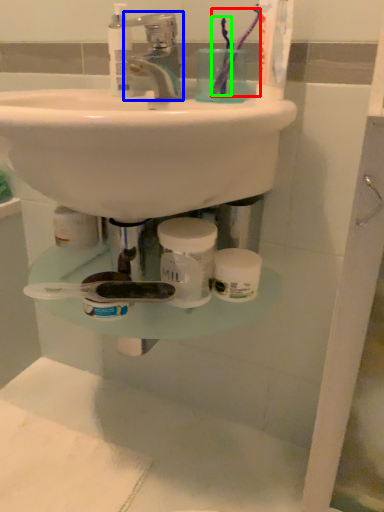
Question: Based on their relative distances, which object is nearer to toothbrush (highlighted by a red box)? Choose from tap (highlighted by a blue box) and toothbrush (highlighted by a green box).

Choices:
 (A) tap
 (B) toothbrush

Answer: (B)